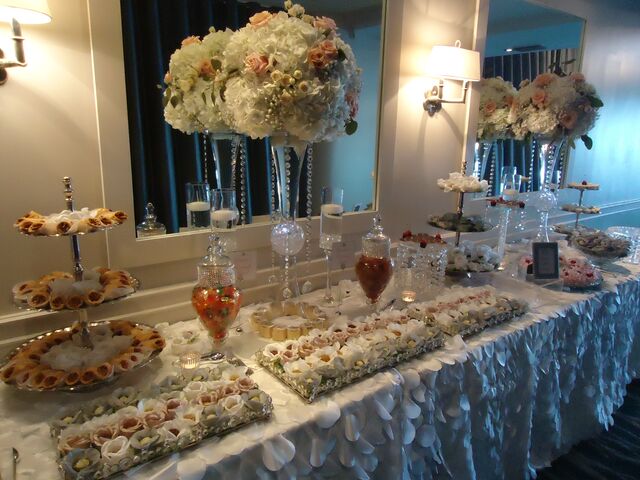
This screenshot has height=480, width=640. What are the coordinates of `vase shaped pitcher` in the screenshot? It's located at (226, 310), (378, 274).